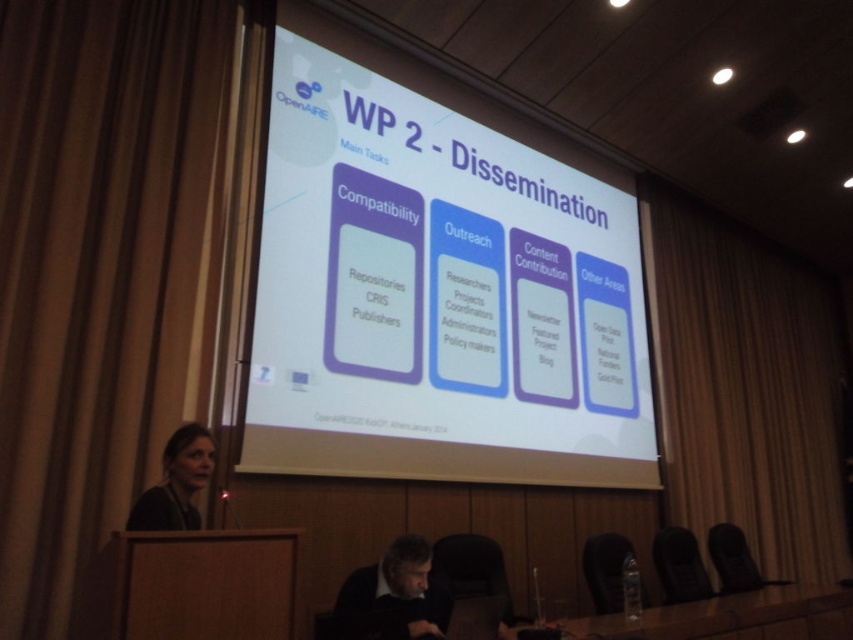
Question: Based on their relative distances, which object is farther from the brown fabric curtain at left?

Choices:
 (A) dark brown leather jacket at lower center
 (B) transparent plastic table at lower center

Answer: (B)

Question: Which point appears closest to the camera in this image?

Choices:
 (A) (61, 332)
 (B) (549, 291)
 (C) (764, 467)

Answer: (A)

Question: Observing the image, what is the correct spatial positioning of brown fabric curtain at right in reference to dark brown leather jacket at lower center?

Choices:
 (A) right
 (B) left

Answer: (A)

Question: Is white glossy projector screen at center to the left of matte black hair at lower left from the viewer's perspective?

Choices:
 (A) no
 (B) yes

Answer: (A)

Question: Can you confirm if brown fabric curtain at right is wider than dark brown leather jacket at lower center?

Choices:
 (A) yes
 (B) no

Answer: (A)

Question: Which object is farther from the camera taking this photo?

Choices:
 (A) transparent plastic table at lower center
 (B) brown fabric curtain at right
 (C) white glossy projector screen at center
 (D) brown fabric curtain at left

Answer: (B)